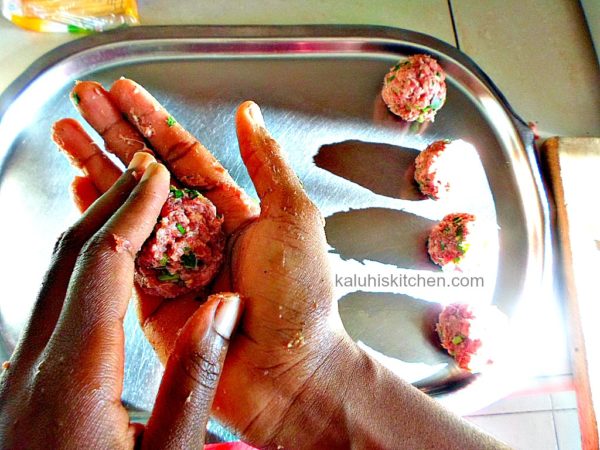
Locate an element on the screen. This screenshot has width=600, height=450. floor is located at coordinates (540, 424).